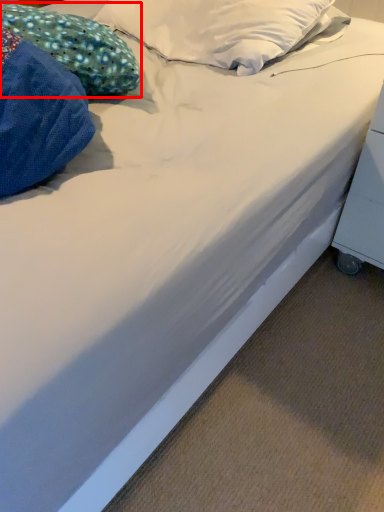
Question: In this image, where is pillow (annotated by the red box) located relative to table?

Choices:
 (A) left
 (B) right

Answer: (A)